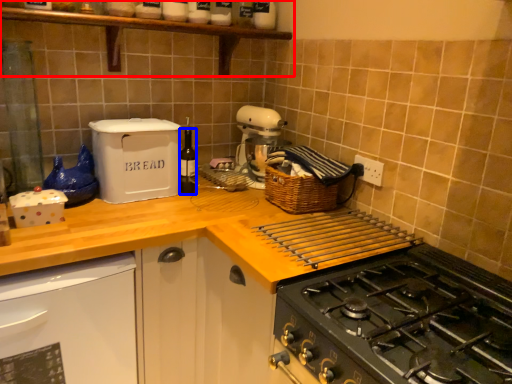
Question: Which object is further to the camera taking this photo, shelf (highlighted by a red box) or bottle (highlighted by a blue box)?

Choices:
 (A) shelf
 (B) bottle

Answer: (B)